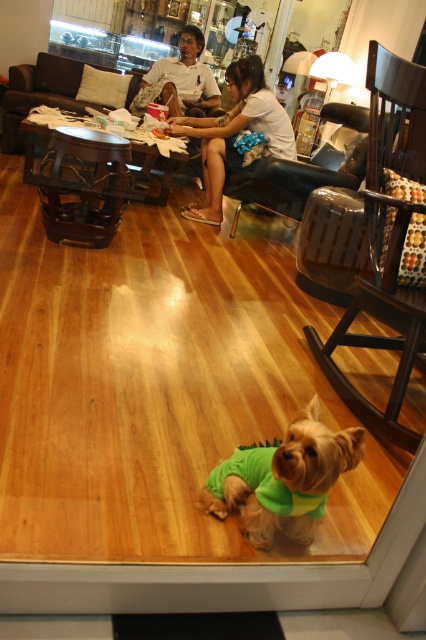
Question: Does green fabric dog at center have a greater width compared to white cotton shirt at upper center?

Choices:
 (A) yes
 (B) no

Answer: (B)

Question: Estimate the real-world distances between objects in this image. Which object is farther from the matte white shirt at upper center?

Choices:
 (A) white cotton shirt at upper center
 (B) green fabric dog at center

Answer: (B)

Question: Does white cotton shirt at upper center have a greater width compared to matte white shirt at upper center?

Choices:
 (A) yes
 (B) no

Answer: (A)

Question: Among these points, which one is nearest to the camera?

Choices:
 (A) (169, 113)
 (B) (207, 120)

Answer: (B)

Question: Which point is closer to the camera taking this photo?

Choices:
 (A) (190, 90)
 (B) (238, 452)

Answer: (B)

Question: Is green fabric dog at center above white cotton shirt at upper center?

Choices:
 (A) yes
 (B) no

Answer: (B)